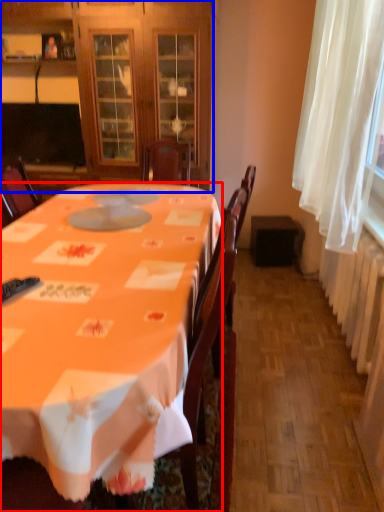
Question: Which of the following is the closest to the observer, desk (highlighted by a red box) or cabinetry (highlighted by a blue box)?

Choices:
 (A) desk
 (B) cabinetry

Answer: (A)